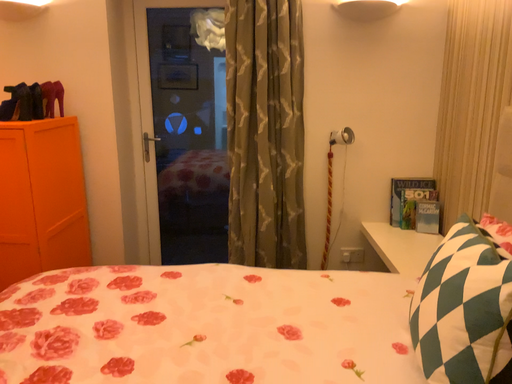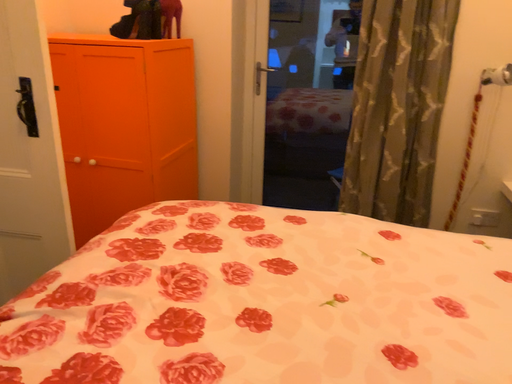
Question: Which way did the camera rotate in the video?

Choices:
 (A) rotated right
 (B) rotated left

Answer: (B)